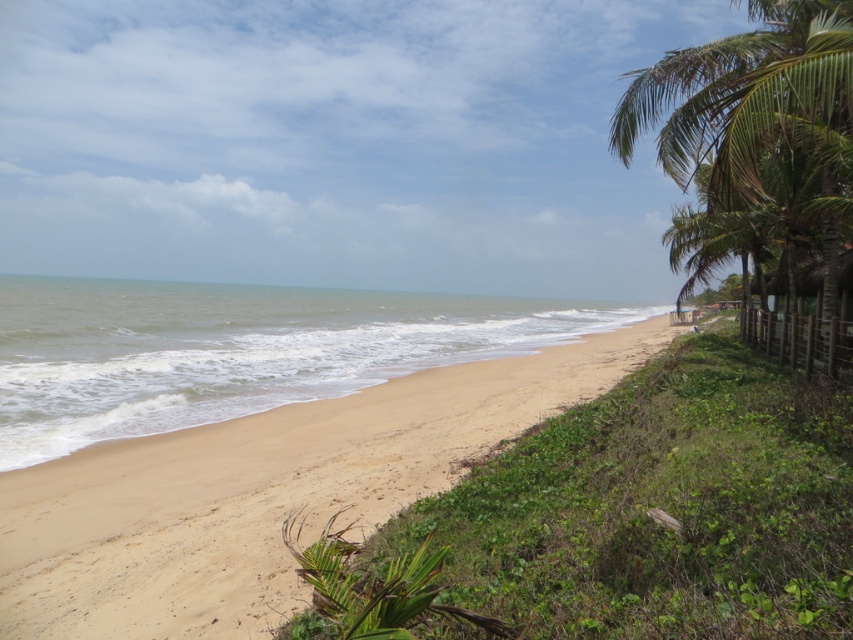
You are a beachgoer standing at the shoreline. You see the light brown sand at center and the green leafy palm tree at right. Which object is closer to you?

The light brown sand at center is closer to you because it has a smaller size compared to the green leafy palm tree at right, which is further away.

You are standing on the beach and want to take a photo of the green leafy palm tree at right without any sand in the foreground. Is the light brown sand at center blocking your view of the palm tree?

The light brown sand at center is in front of the green leafy palm tree at right, so it will block your view of the palm tree. You need to move to a position where the sand is not between you and the palm tree.